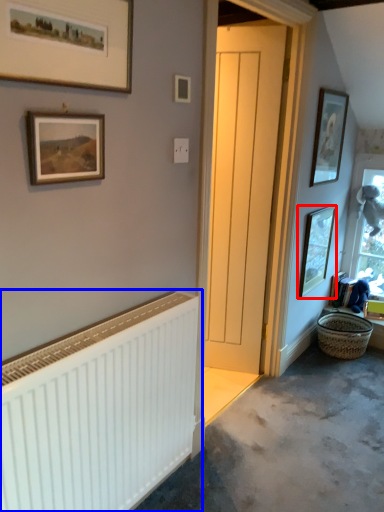
Question: Which of the following is the farthest to the observer, picture frame (highlighted by a red box) or radiator (highlighted by a blue box)?

Choices:
 (A) picture frame
 (B) radiator

Answer: (A)